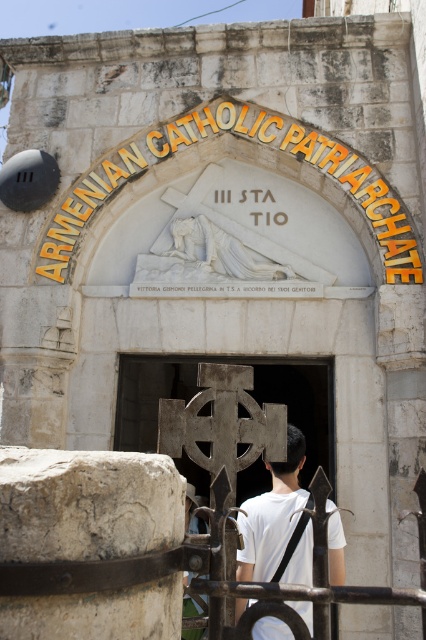
Is point (166, 147) behind point (288, 470)?

That is True.

In order to click on white stone relief at upper center in this screenshot , I will do `click(247, 138)`.

Identify the location of white stone relief at upper center. (247, 138).